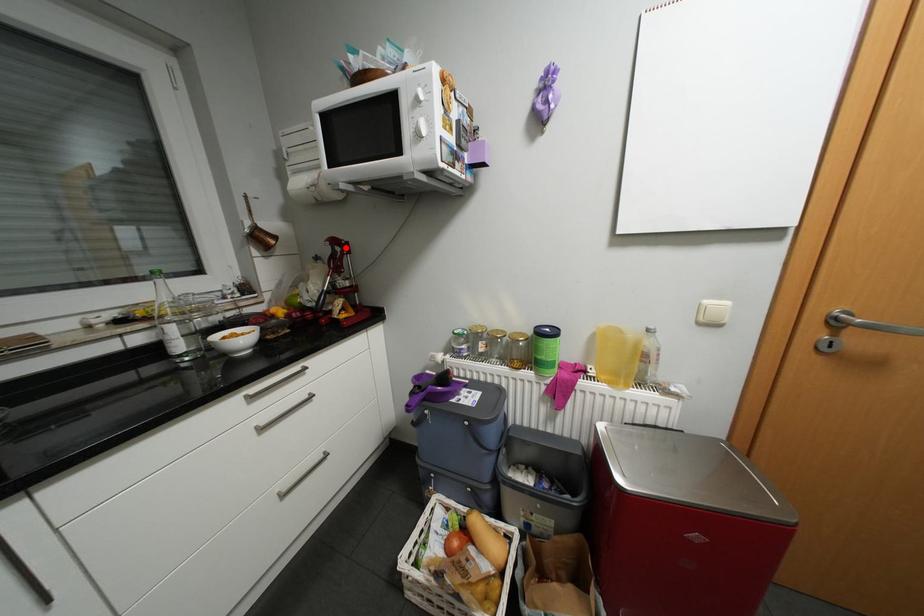
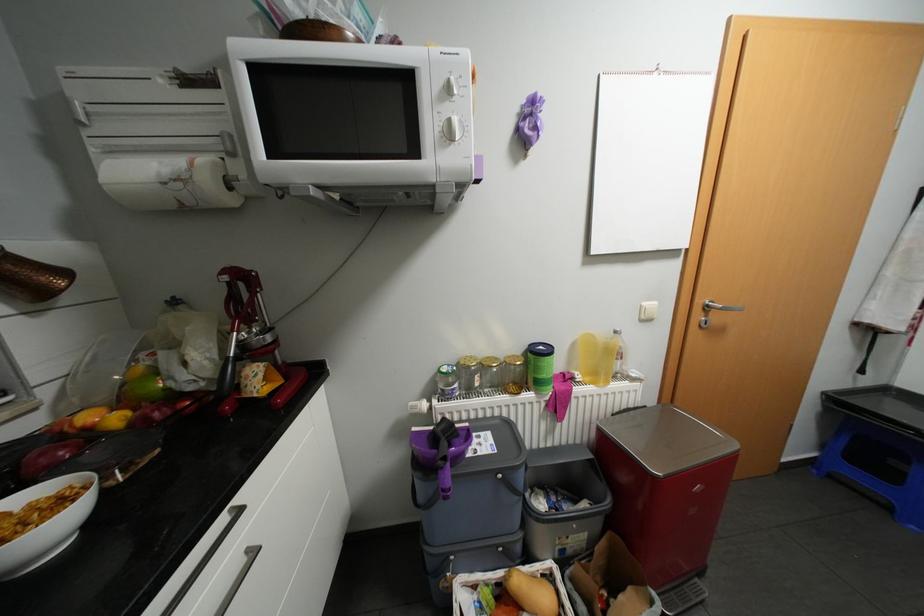
The point at the highlighted location is marked in the first image. Where is the corresponding point in the second image?

(248, 284)